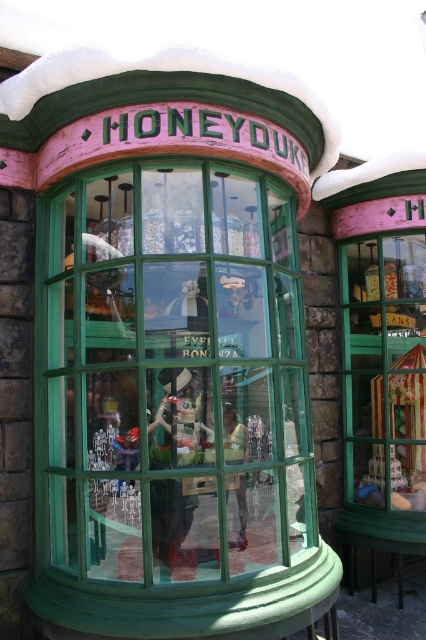
You are a customer standing outside the Honeydukes storefront. You see the green glass window at center and the striped fabric tent at right. Which object is nearer to you?

The green glass window at center is closer to the viewer than the striped fabric tent at right.

You are standing outside the Honeydukes storefront and want to find the green glass window at center. Based on the coordinates provided, can you determine its position relative to the storefront?

The green glass window at center is located at coordinates point (175, 374), which means it is positioned slightly to the right and lower center of the storefront.